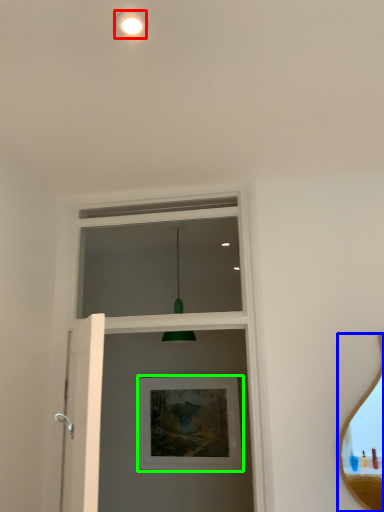
Question: Which object is positioned farthest from droplight (highlighted by a red box)? Select from mirror (highlighted by a blue box) and picture frame (highlighted by a green box).

Choices:
 (A) mirror
 (B) picture frame

Answer: (B)